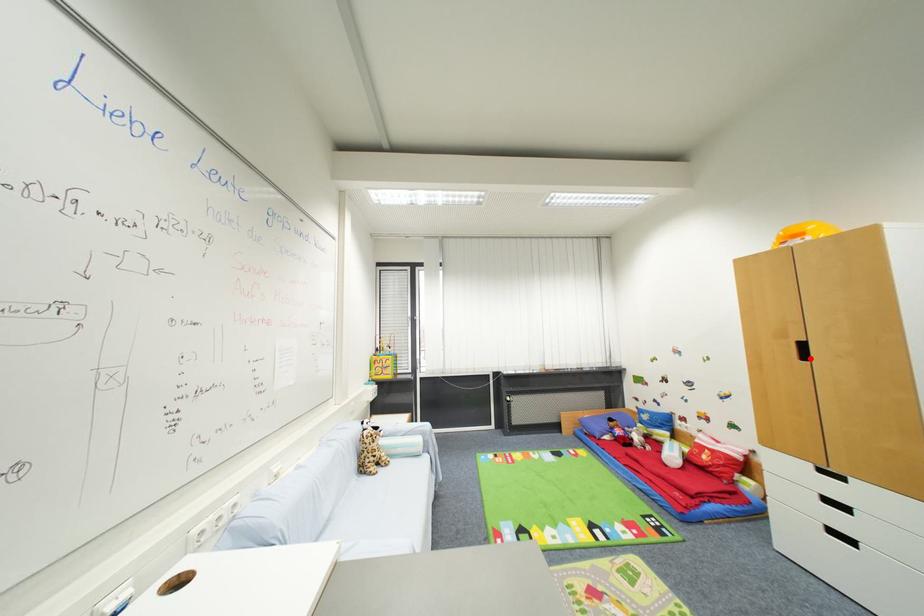
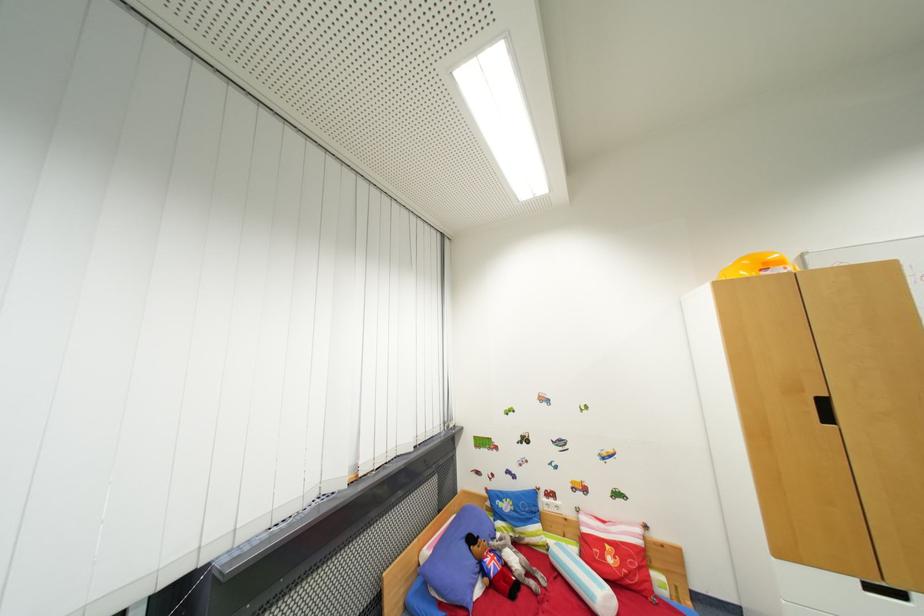
Find the pixel in the second image that matches the highlighted location in the first image.

(833, 419)